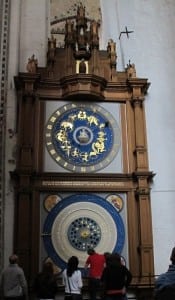
Locate an element on the screen. The width and height of the screenshot is (175, 300). clock is located at coordinates (81, 152).